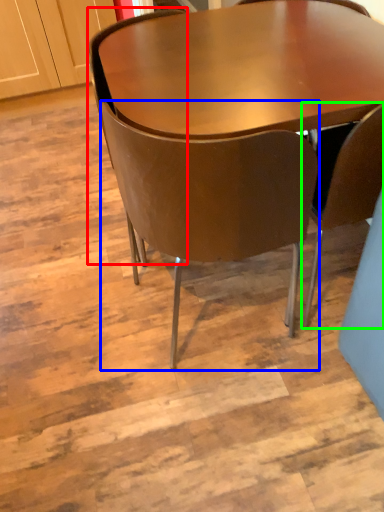
Question: Considering the real-world distances, which object is farthest from chair (highlighted by a red box)? chair (highlighted by a blue box) or chair (highlighted by a green box)?

Choices:
 (A) chair
 (B) chair

Answer: (B)